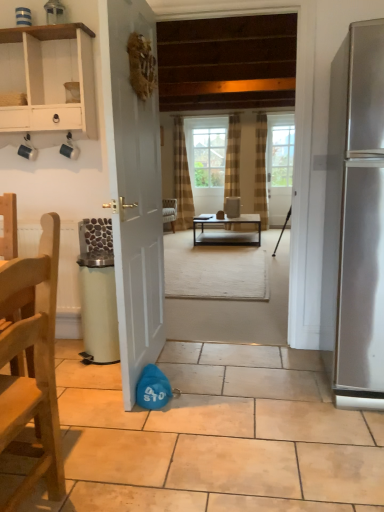
Locate an element on the screen. The image size is (384, 512). vacant space to the right of white matte door at center, which ranks as the 1th door in left-to-right order is located at coordinates (x=231, y=374).